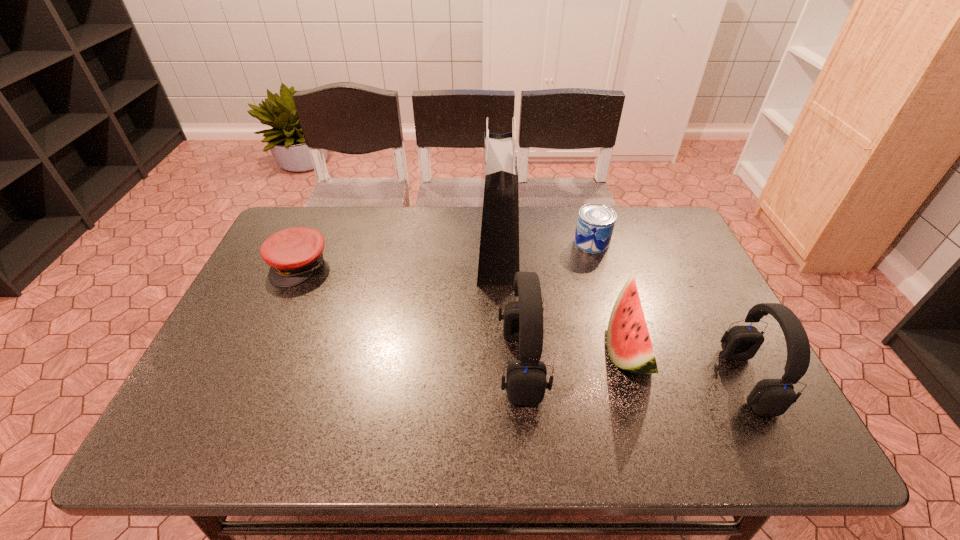
At what (x,y) coordinates should I click in order to perform the action: click on vacant region between the can and the fifth shortest object. Please return your answer as a coordinate pair (x, y). Looking at the image, I should click on (557, 303).

Image resolution: width=960 pixels, height=540 pixels. What are the coordinates of `free space between the third shortest object and the rightmost object` in the screenshot? It's located at (687, 364).

I want to click on blank region between the taller headset and the right headset, so click(635, 373).

The image size is (960, 540). In order to click on free point between the taller headset and the fifth tallest object in this screenshot , I will do `click(557, 303)`.

Identify which object is located as the fourth nearest to the cap. Please provide its 2D coordinates. Your answer should be formatted as a tuple, i.e. [(x, y)], where the tuple contains the x and y coordinates of a point satisfying the conditions above.

[(629, 345)]

Identify which object is the fifth closest to the tallest object. Please provide its 2D coordinates. Your answer should be formatted as a tuple, i.e. [(x, y)], where the tuple contains the x and y coordinates of a point satisfying the conditions above.

[(770, 397)]